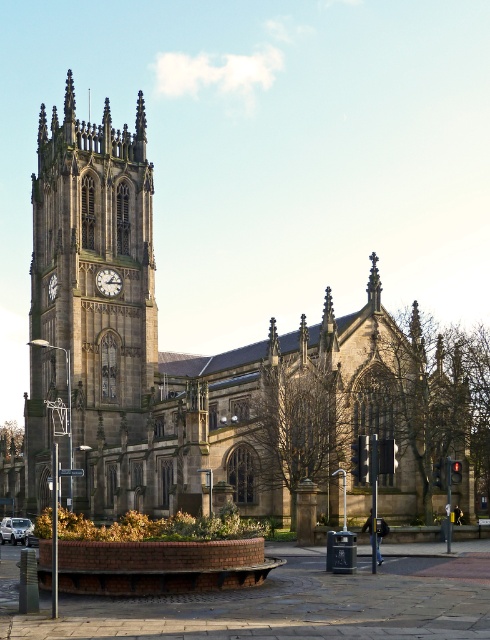
Question: Can you confirm if brown stone church at center is positioned to the right of stone clock tower at center?

Choices:
 (A) no
 (B) yes

Answer: (B)

Question: Considering the real-world distances, which object is farthest from the stone clock tower at center?

Choices:
 (A) matte brown clock at center-left
 (B) brown stone church at center

Answer: (A)

Question: Can you confirm if stone clock tower at center is smaller than matte brown clock at center-left?

Choices:
 (A) yes
 (B) no

Answer: (B)

Question: Which point is closer to the camera?

Choices:
 (A) (113, 292)
 (B) (31, 394)

Answer: (A)

Question: Does stone clock tower at center have a greater width compared to matte brown clock at center-left?

Choices:
 (A) yes
 (B) no

Answer: (A)

Question: Based on their relative distances, which object is farther from the stone clock tower at center?

Choices:
 (A) brown stone church at center
 (B) matte brown clock at center-left

Answer: (B)